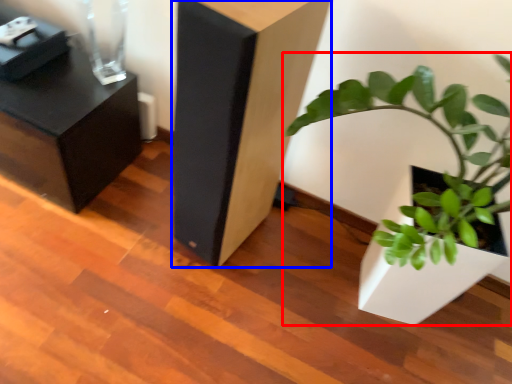
Question: Which object appears closest to the camera in this image, houseplant (highlighted by a red box) or furniture (highlighted by a blue box)?

Choices:
 (A) houseplant
 (B) furniture

Answer: (A)